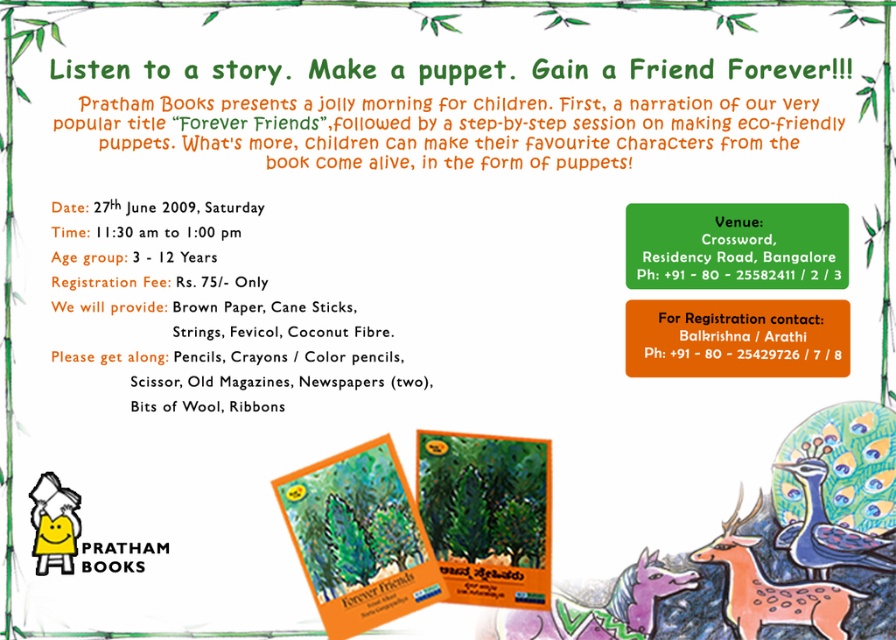
You are organizing the event and need to place a decorative ribbon between the matte orange deer at center and the matte orange book at lower left. The ribbon is 24 inches long. Will the ribbon be long enough to stretch between them?

The matte orange deer at center and matte orange book at lower left are 23.52 inches apart. Since the ribbon is 24 inches long, it will be long enough to stretch between them with a little extra length remaining.